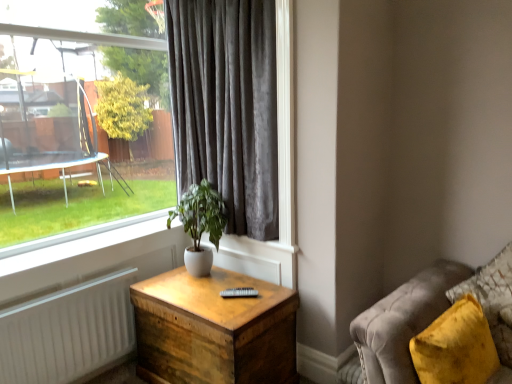
Question: Considering the relative sizes of white ceramic plant at center and wooden nightstand at center in the image provided, is white ceramic plant at center taller than wooden nightstand at center?

Choices:
 (A) no
 (B) yes

Answer: (A)

Question: Considering the relative sizes of white ceramic plant at center and wooden nightstand at center in the image provided, is white ceramic plant at center thinner than wooden nightstand at center?

Choices:
 (A) yes
 (B) no

Answer: (A)

Question: Is white ceramic plant at center beside wooden nightstand at center?

Choices:
 (A) no
 (B) yes

Answer: (A)

Question: Does white ceramic plant at center have a larger size compared to wooden nightstand at center?

Choices:
 (A) yes
 (B) no

Answer: (B)

Question: Are white ceramic plant at center and wooden nightstand at center located far from each other?

Choices:
 (A) yes
 (B) no

Answer: (B)

Question: From the image's perspective, is velvet yellow pillow at lower right above or below clear glass window at upper left?

Choices:
 (A) above
 (B) below

Answer: (B)

Question: Is velvet yellow pillow at lower right bigger or smaller than clear glass window at upper left?

Choices:
 (A) big
 (B) small

Answer: (B)

Question: Is velvet yellow pillow at lower right inside the boundaries of clear glass window at upper left, or outside?

Choices:
 (A) inside
 (B) outside

Answer: (B)

Question: From a real-world perspective, relative to clear glass window at upper left, is velvet yellow pillow at lower right vertically above or below?

Choices:
 (A) below
 (B) above

Answer: (A)

Question: Is point (256, 195) closer or farther from the camera than point (503, 279)?

Choices:
 (A) farther
 (B) closer

Answer: (A)

Question: Which is correct: velvet gray curtain at center is inside velvet yellow pillow at lower right, or outside of it?

Choices:
 (A) inside
 (B) outside

Answer: (B)

Question: Considering the positions of velvet gray curtain at center and velvet yellow pillow at lower right in the image, is velvet gray curtain at center wider or thinner than velvet yellow pillow at lower right?

Choices:
 (A) thin
 (B) wide

Answer: (A)

Question: Considering the positions of velvet gray curtain at center and velvet yellow pillow at lower right in the image, is velvet gray curtain at center taller or shorter than velvet yellow pillow at lower right?

Choices:
 (A) short
 (B) tall

Answer: (B)

Question: Is velvet yellow pillow at lower right bigger or smaller than velvet gray curtain at center?

Choices:
 (A) small
 (B) big

Answer: (A)

Question: Would you say velvet yellow pillow at lower right is to the left or to the right of velvet gray curtain at center in the picture?

Choices:
 (A) right
 (B) left

Answer: (A)